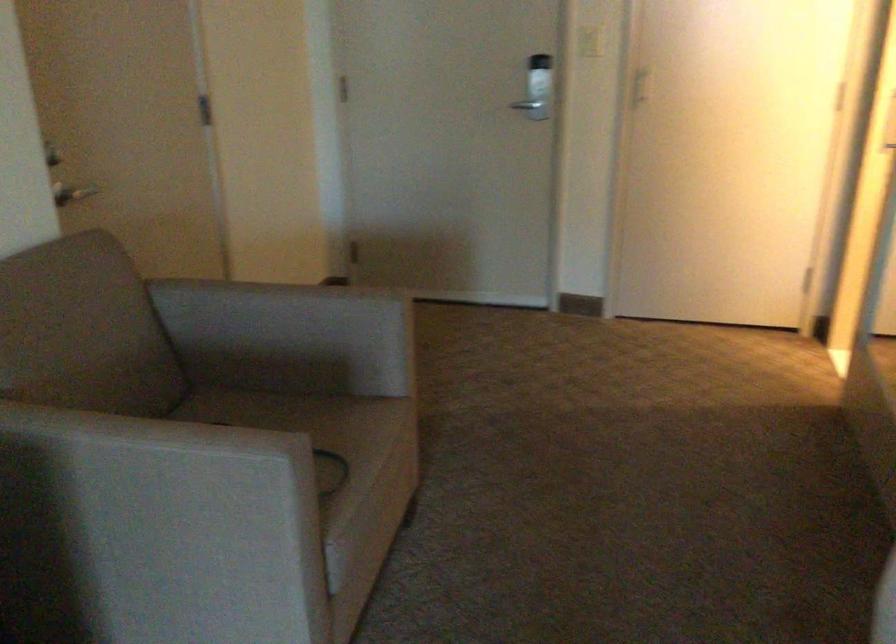
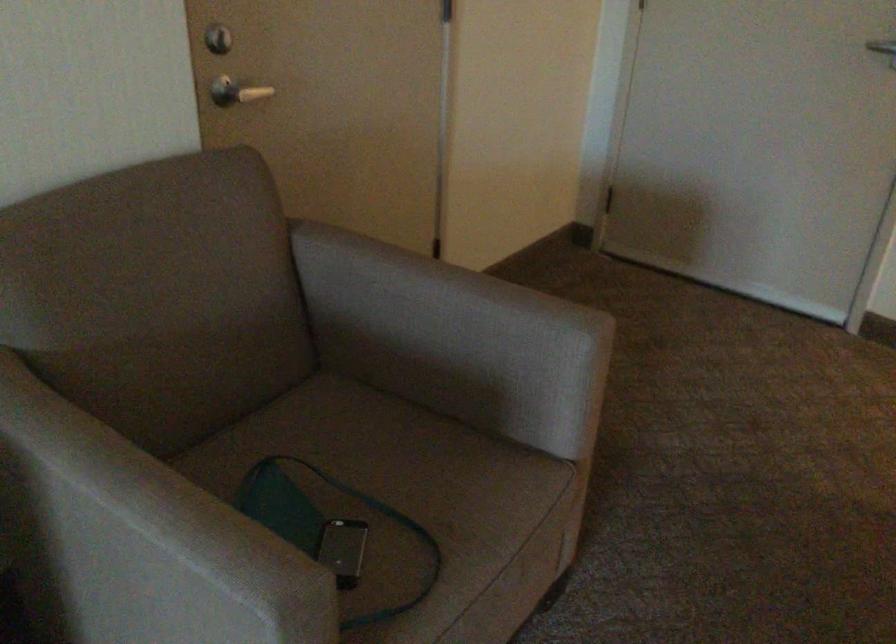
The point at (x=75, y=189) is marked in the first image. Where is the corresponding point in the second image?

(236, 91)